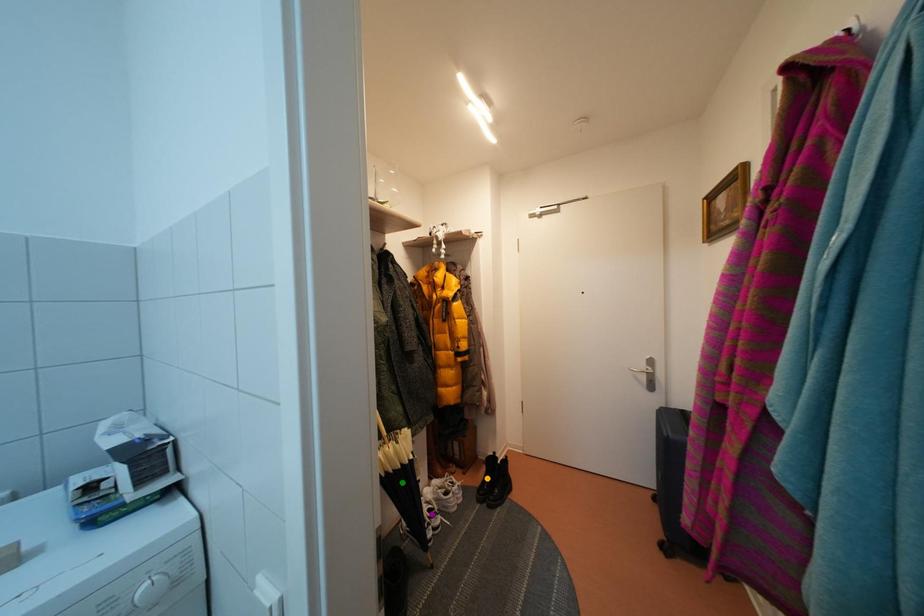
Order these from farthest to nearest:
purple point | green point | orange point

1. orange point
2. purple point
3. green point